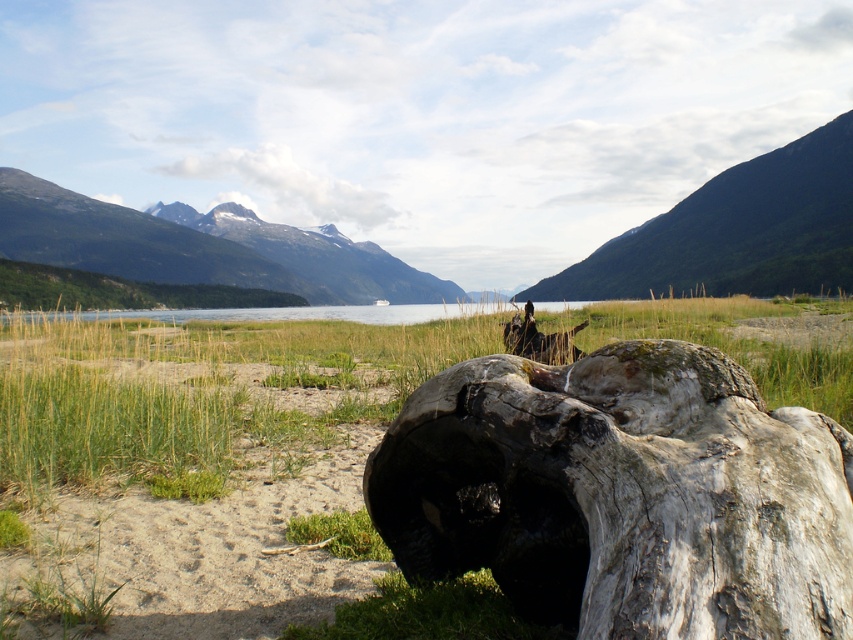
Does green grass at lower left appear over green forested mountain at upper left?

Incorrect, green grass at lower left is not positioned above green forested mountain at upper left.

Between green grass at lower left and green forested mountain at upper left, which one appears on the right side from the viewer's perspective?

Positioned to the right is green grass at lower left.

Is point (212, 435) positioned before point (194, 273)?

Yes, point (212, 435) is in front of point (194, 273).

I want to click on green grass at lower left, so [x=216, y=477].

Which is more to the right, green textured mountain at upper center or green forested mountain at upper left?

green textured mountain at upper center

Can you confirm if green textured mountain at upper center is positioned above green forested mountain at upper left?

Correct, green textured mountain at upper center is located above green forested mountain at upper left.

Identify the location of green textured mountain at upper center. (735, 230).

Who is positioned more to the right, green grass at lower left or green textured mountain at upper center?

green textured mountain at upper center is more to the right.

Who is more forward, (22, 564) or (639, 262)?

Point (22, 564) is in front.

Is point (505, 618) farther from viewer compared to point (842, 118)?

No, (505, 618) is in front of (842, 118).

What are the coordinates of `green grass at lower left` in the screenshot? It's located at (216, 477).